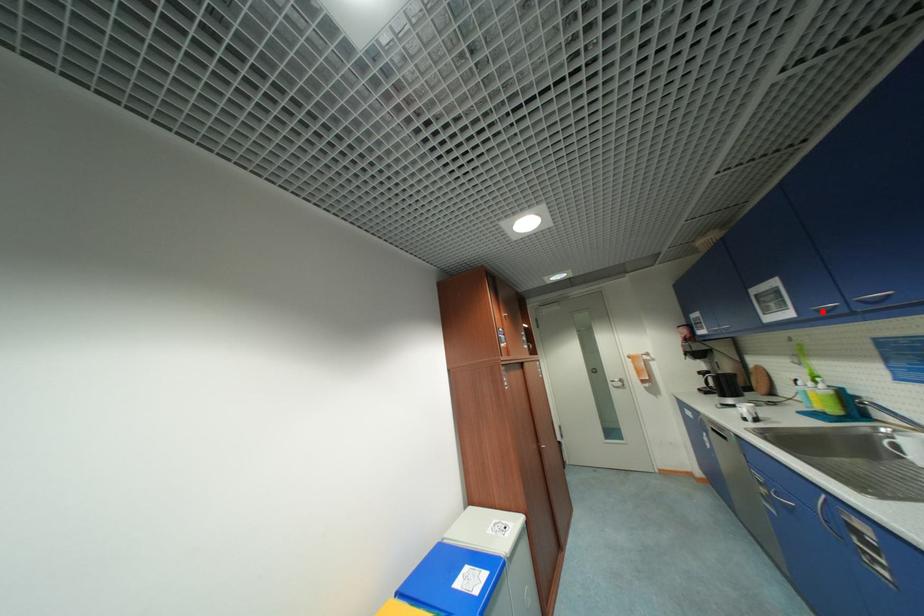
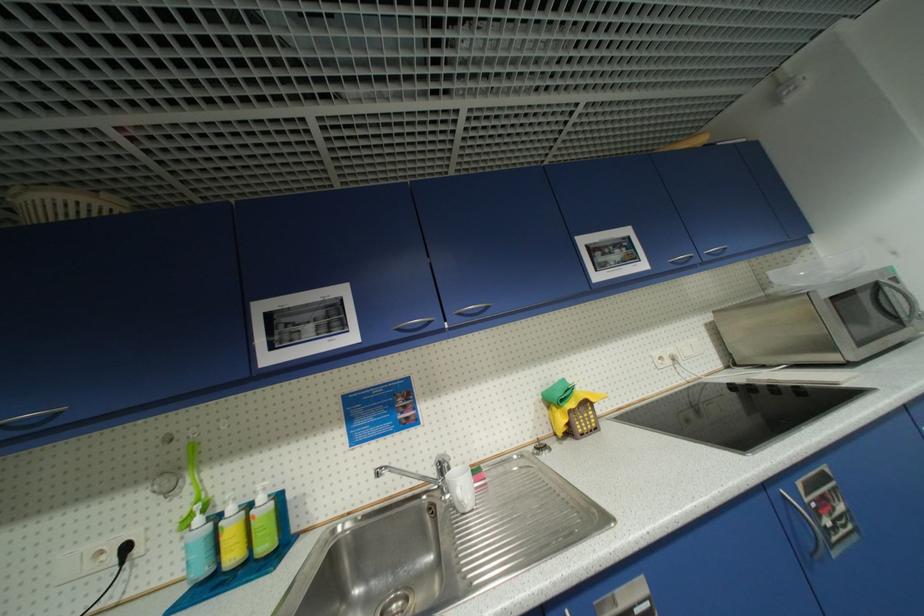
In the second image, find the point that corresponds to the highlighted location in the first image.

(405, 331)